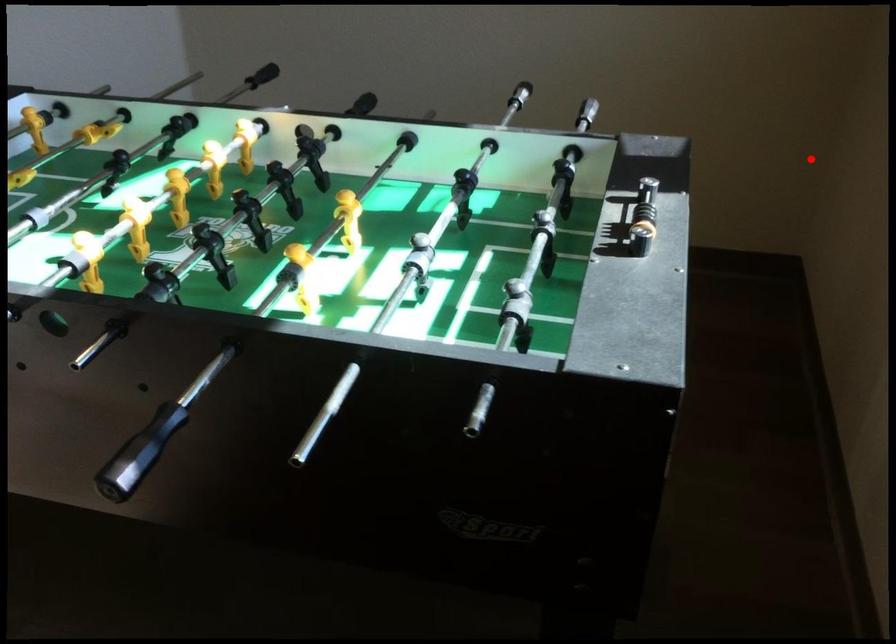
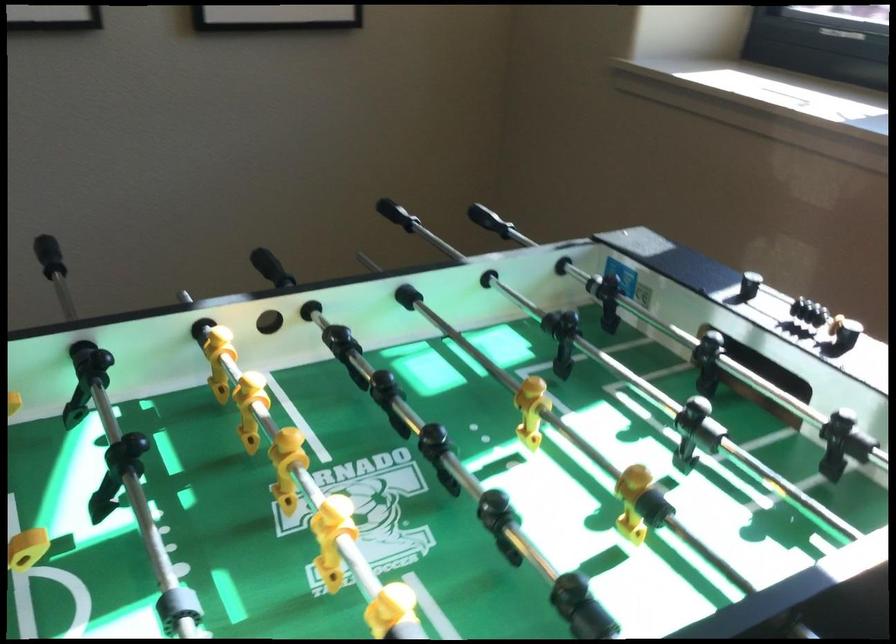
The point at the highlighted location is marked in the first image. Where is the corresponding point in the second image?

(488, 220)